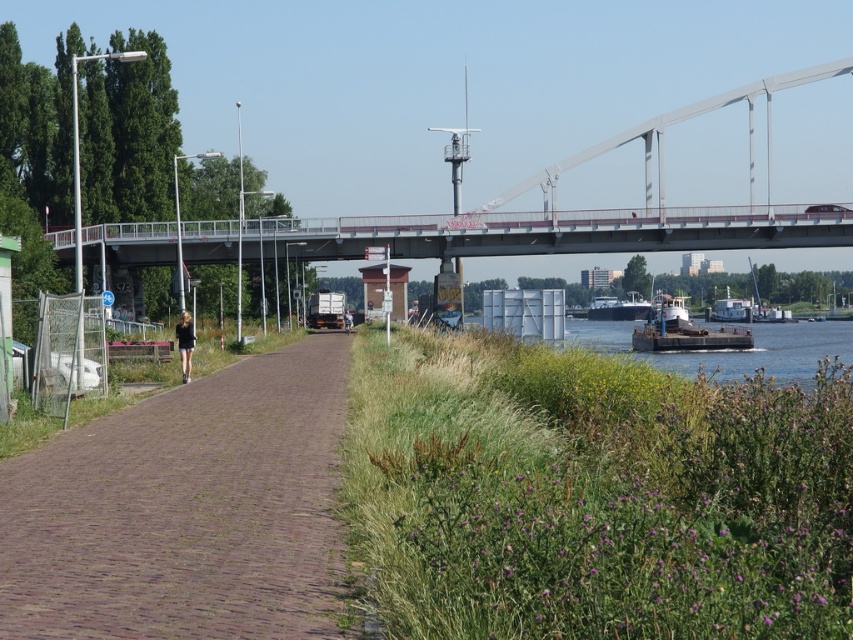
Which is more to the right, metallic gray bridge at upper center or brown wooden barge at lower right?

brown wooden barge at lower right is more to the right.

Who is shorter, metallic gray bridge at upper center or brown wooden barge at lower right?

Standing shorter between the two is brown wooden barge at lower right.

Does point (422, 221) lie in front of point (836, 330)?

Yes, it is.

At what (x,y) coordinates should I click in order to perform the action: click on metallic gray bridge at upper center. Please return your answer as a coordinate pair (x, y). Looking at the image, I should click on (519, 214).

Is point (239, 570) positioned behind point (757, 328)?

No, it is in front of (757, 328).

Which is below, brown cobblestone path at center or brown wooden barge at lower right?

Positioned lower is brown wooden barge at lower right.

Who is more distant from viewer, (341, 337) or (809, 384)?

The point (341, 337) is behind.

Image resolution: width=853 pixels, height=640 pixels. In order to click on brown cobblestone path at center in this screenshot , I will do (x=184, y=509).

Is point (505, 216) positioned in front of point (621, 308)?

That is True.

Does concrete bridge at center appear on the right side of dark gray metallic barge at lower center?

In fact, concrete bridge at center is to the left of dark gray metallic barge at lower center.

Locate an element on the screen. The height and width of the screenshot is (640, 853). concrete bridge at center is located at coordinates (555, 230).